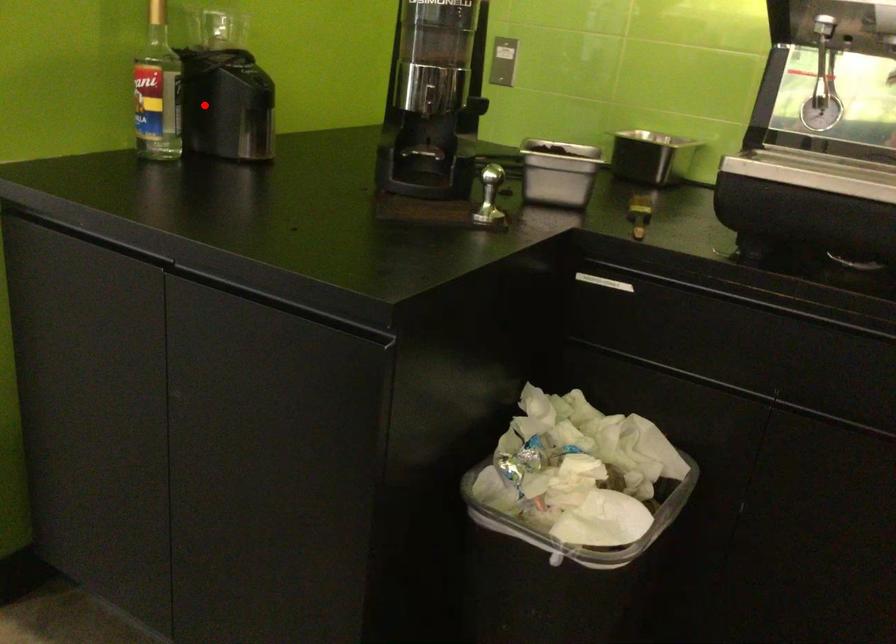
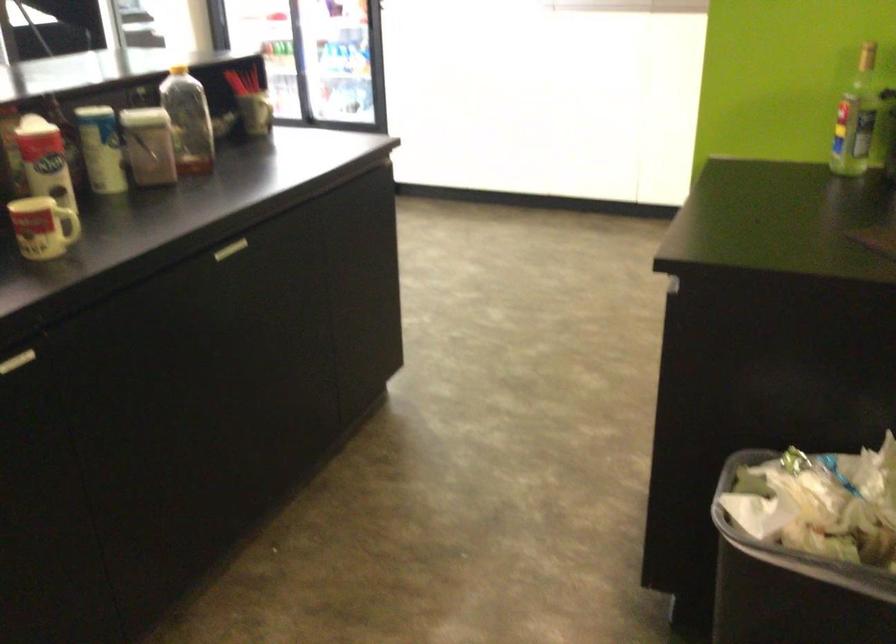
Find the pixel in the second image that matches the highlighted location in the first image.

(856, 118)